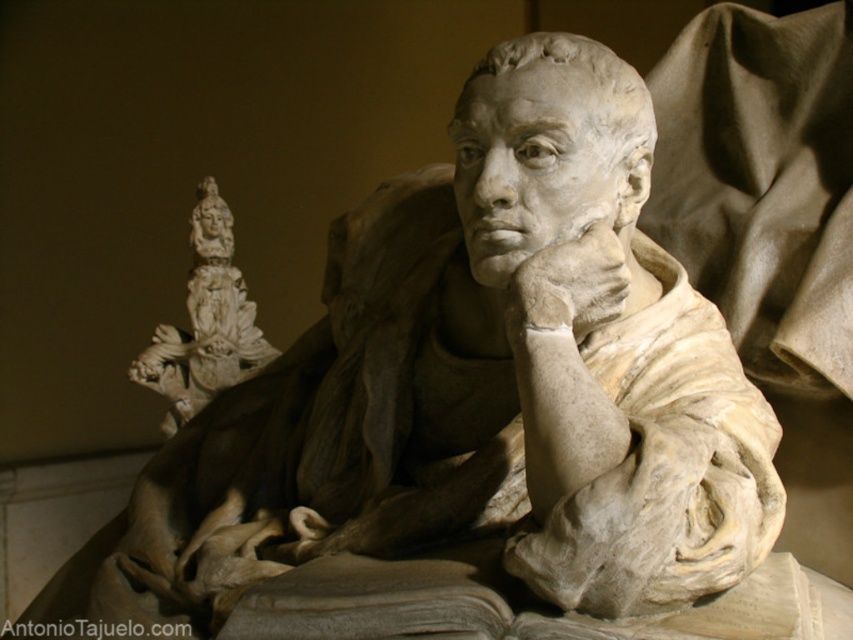
Question: Which object is closer to the camera taking this photo?

Choices:
 (A) white marble statue at upper left
 (B) white marble hand at center

Answer: (B)

Question: Does white marble statue at upper left appear on the right side of white marble hand at center?

Choices:
 (A) no
 (B) yes

Answer: (A)

Question: Which point is farther to the camera?

Choices:
 (A) white marble hand at center
 (B) white marble statue at upper left

Answer: (B)

Question: Does white marble statue at upper left have a larger size compared to white marble hand at center?

Choices:
 (A) yes
 (B) no

Answer: (A)

Question: From the image, what is the correct spatial relationship of white marble statue at upper left in relation to white marble hand at center?

Choices:
 (A) above
 (B) below

Answer: (A)